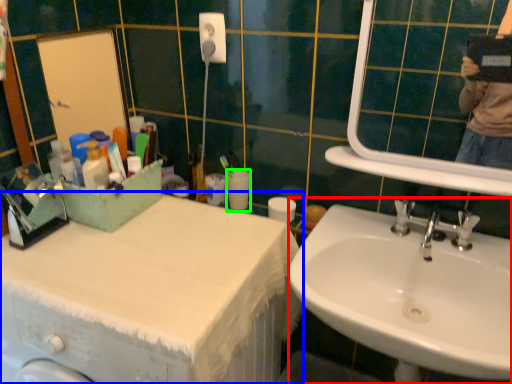
Question: Which object is the farthest from sink (highlighted by a red box)? Choose among these: counter top (highlighted by a blue box) or toilet paper (highlighted by a green box).

Choices:
 (A) counter top
 (B) toilet paper

Answer: (B)